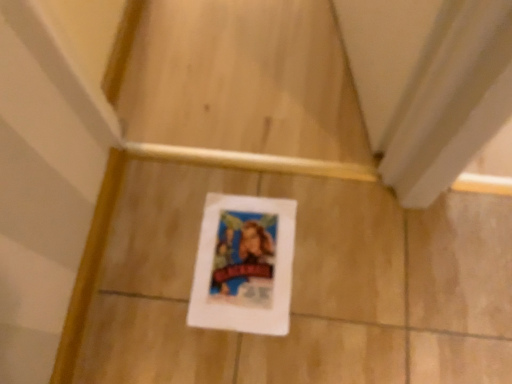
This screenshot has width=512, height=384. What do you see at coordinates (244, 265) in the screenshot?
I see `white paper at center` at bounding box center [244, 265].

The image size is (512, 384). Find the location of `white paper at center`. white paper at center is located at coordinates (244, 265).

Locate an element on the screen. The width and height of the screenshot is (512, 384). white paper at center is located at coordinates (244, 265).